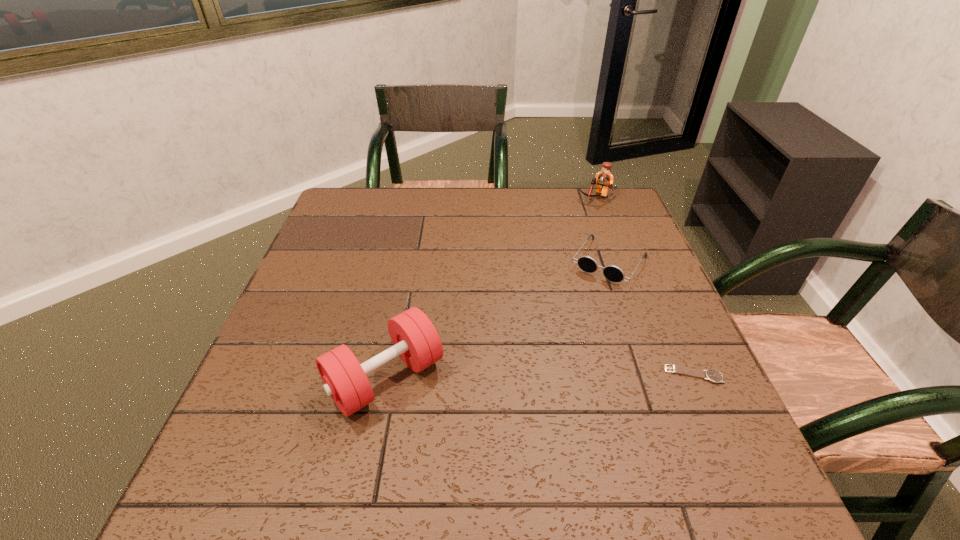
Where is `free space in the image that satisfies the following two spatial constraints: 1. on the back side of the dumbbell; 2. on the left side of the Lego`? The width and height of the screenshot is (960, 540). free space in the image that satisfies the following two spatial constraints: 1. on the back side of the dumbbell; 2. on the left side of the Lego is located at coordinates (420, 198).

The width and height of the screenshot is (960, 540). Find the location of `free spot that satisfies the following two spatial constraints: 1. on the back side of the Lego; 2. on the right side of the second farthest object`. free spot that satisfies the following two spatial constraints: 1. on the back side of the Lego; 2. on the right side of the second farthest object is located at coordinates (587, 198).

Find the location of `vacant region that satisfies the following two spatial constraints: 1. on the back side of the third nearest object; 2. on the right side of the farthest object`. vacant region that satisfies the following two spatial constraints: 1. on the back side of the third nearest object; 2. on the right side of the farthest object is located at coordinates (587, 198).